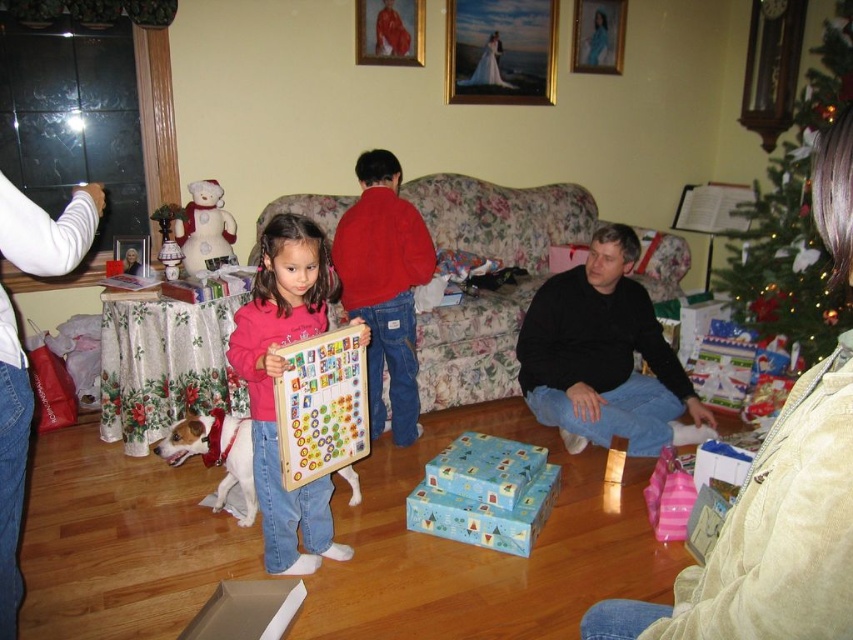
Question: Which object is the farthest from the pink matte board game at center?

Choices:
 (A) metallic photo frame at center
 (B) white glossy bag at left
 (C) metallic gold picture frame at upper center
 (D) matte wooden picture frame at upper center

Answer: (C)

Question: Can you confirm if wooden puzzle board at center is wider than matte wooden picture frame at upper center?

Choices:
 (A) yes
 (B) no

Answer: (B)

Question: Is white glossy bag at left below metallic gold picture frame at upper center?

Choices:
 (A) yes
 (B) no

Answer: (A)

Question: Which of the following is the closest to the observer?

Choices:
 (A) metallic gold picture frame at upper center
 (B) pink matte board game at center
 (C) white glossy bag at left

Answer: (C)

Question: Which of the following is the closest to the observer?

Choices:
 (A) (636, 348)
 (B) (329, 410)
 (C) (125, 243)
 (D) (251, 304)

Answer: (D)

Question: From the image, what is the correct spatial relationship of green textured christmas tree at upper right in relation to wooden picture frame at upper center?

Choices:
 (A) right
 (B) left

Answer: (A)